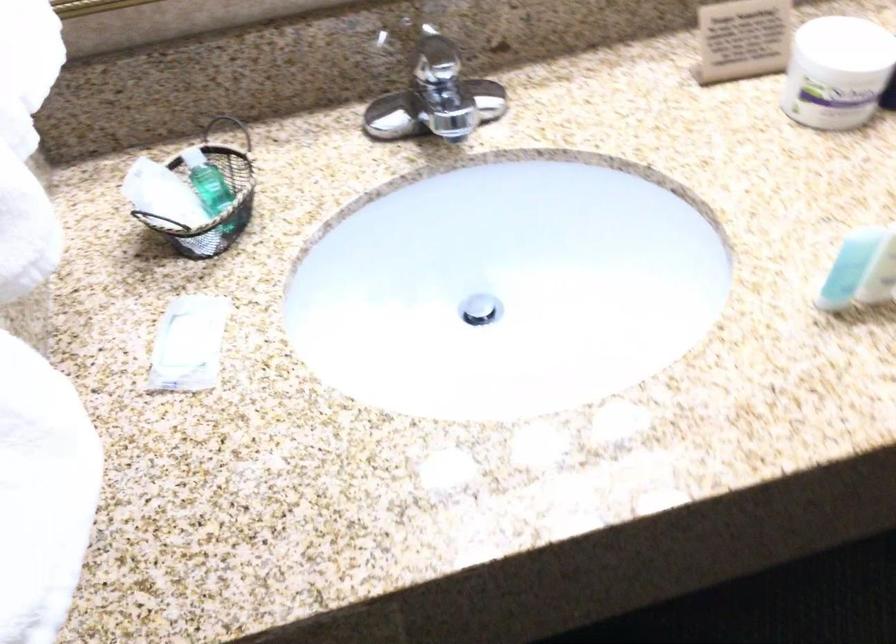
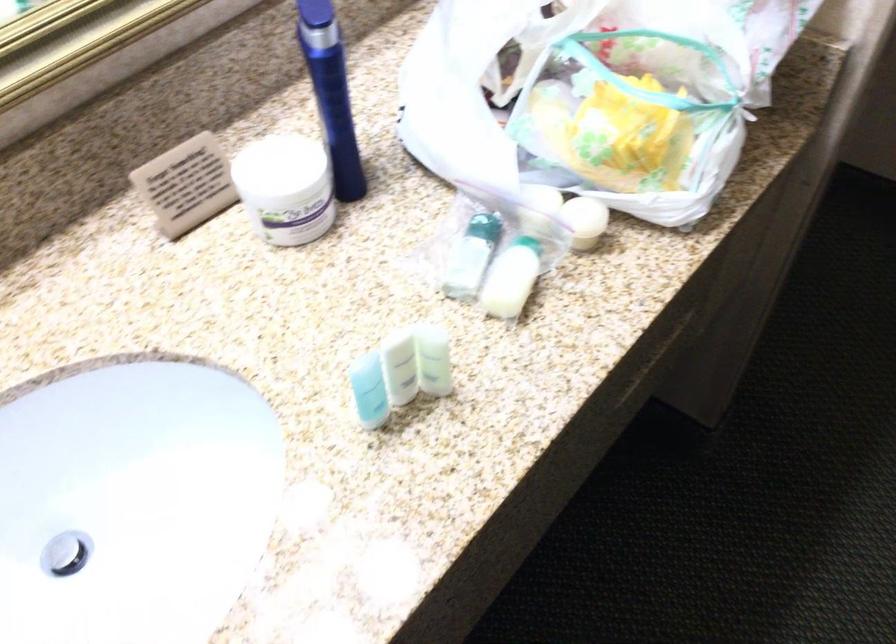
Question: Based on the continuous images, in which direction is the camera rotating? Reply with the corresponding letter.

Choices:
 (A) Left
 (B) Right
 (C) Up
 (D) Down

Answer: (B)